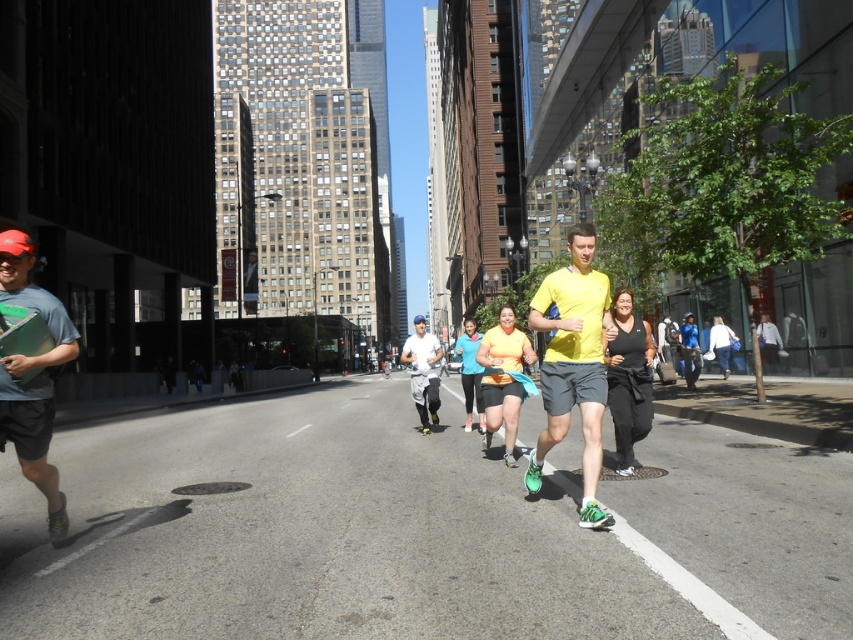
Does yellow matte shirt at center appear on the right side of white matte running shoes at center?

Correct, you'll find yellow matte shirt at center to the right of white matte running shoes at center.

Does yellow matte shirt at center appear under white matte running shoes at center?

No, yellow matte shirt at center is not below white matte running shoes at center.

Is point (595, 355) positioned before point (436, 358)?

Yes, point (595, 355) is closer to viewer.

Image resolution: width=853 pixels, height=640 pixels. Identify the location of yellow matte shirt at center. (573, 364).

Is matte gray shirt at left to the right of white matte running shoes at center from the viewer's perspective?

No, matte gray shirt at left is not to the right of white matte running shoes at center.

Which of these two, matte gray shirt at left or white matte running shoes at center, stands shorter?

Standing shorter between the two is matte gray shirt at left.

What do you see at coordinates (32, 371) in the screenshot? I see `matte gray shirt at left` at bounding box center [32, 371].

The image size is (853, 640). Find the location of `matte gray shirt at left`. matte gray shirt at left is located at coordinates (32, 371).

Is yellow matte shirt at center above matte gray shirt at left?

Indeed, yellow matte shirt at center is positioned over matte gray shirt at left.

Locate an element on the screen. Image resolution: width=853 pixels, height=640 pixels. yellow matte shirt at center is located at coordinates (573, 364).